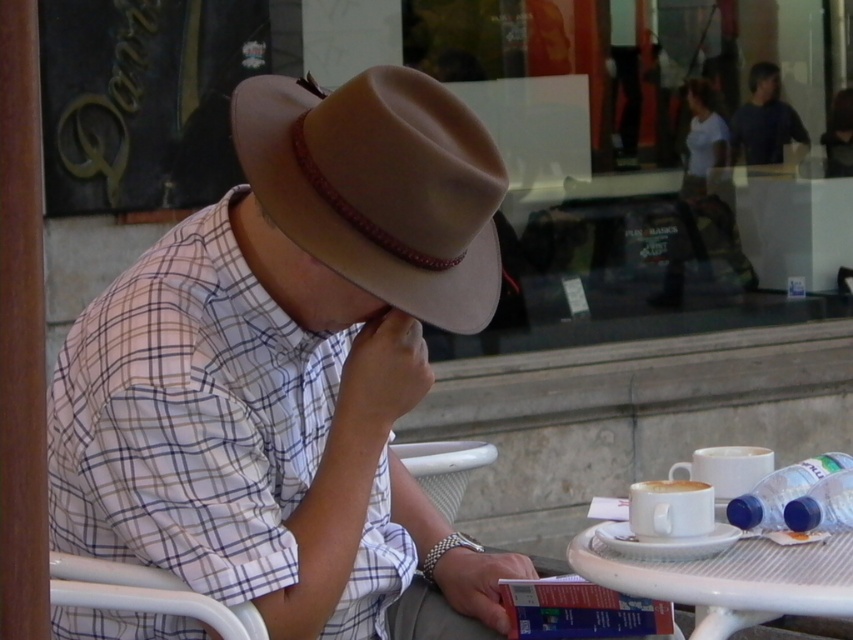
Question: Which of the following is the closest to the observer?

Choices:
 (A) (218, 380)
 (B) (387, 301)
 (C) (654, 582)
 (D) (634, 488)

Answer: (C)

Question: Which point is closer to the camera taking this photo?

Choices:
 (A) (364, 461)
 (B) (459, 214)
 (C) (775, 570)

Answer: (C)

Question: From the image, what is the correct spatial relationship of matte brown hat at center in relation to suede brown fedora at center?

Choices:
 (A) above
 (B) below

Answer: (B)

Question: Is suede brown fedora at center below white matte cup at lower right?

Choices:
 (A) no
 (B) yes

Answer: (A)

Question: Is matte brown hat at center above white plastic table at lower right?

Choices:
 (A) yes
 (B) no

Answer: (A)

Question: Estimate the real-world distances between objects in this image. Which object is farther from the white matte cup at lower right?

Choices:
 (A) white plastic table at lower right
 (B) suede brown fedora at center
 (C) matte brown hat at center

Answer: (B)